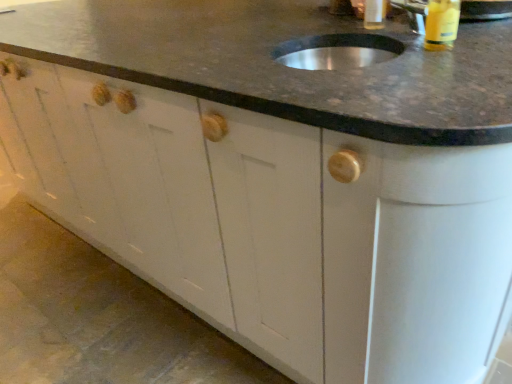
The height and width of the screenshot is (384, 512). Find the location of `vacant area that is in front of yellow plastic bottle at upper right, positioned as the 1th beverage in right-to-left order`. vacant area that is in front of yellow plastic bottle at upper right, positioned as the 1th beverage in right-to-left order is located at coordinates (438, 62).